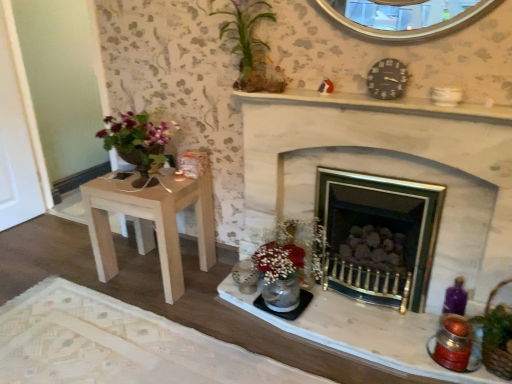
What is the approximate height of white marble mantel at upper center?

The height of white marble mantel at upper center is 1.61 inches.

Locate an element on the screen. Image resolution: width=512 pixels, height=384 pixels. black plastic clock at upper right is located at coordinates point(387,79).

This screenshot has height=384, width=512. In order to click on light brown wood table at left in this screenshot , I will do `click(150, 223)`.

Could you tell me if white stone fireplace at center is facing brown woven basket at lower right?

Yes, white stone fireplace at center is turned towards brown woven basket at lower right.

Locate an element on the screen. basket behind the white stone fireplace at center is located at coordinates (498, 363).

Is white stone fireplace at center touching brown woven basket at lower right?

No, white stone fireplace at center is not next to brown woven basket at lower right.

Based on the photo, from a real-world perspective, is white stone fireplace at center over brown woven basket at lower right?

Yes, from a real-world perspective, white stone fireplace at center is over brown woven basket at lower right

Is there a large distance between shiny metallic candle holder at lower right, the second candle holder from the left, and black plastic clock at upper right?

They are positioned close to each other.

How different are the orientations of shiny metallic candle holder at lower right, the second candle holder from the left, and black plastic clock at upper right in degrees?

There is a 5.84-degree angle between the facing directions of shiny metallic candle holder at lower right, the second candle holder from the left, and black plastic clock at upper right.

Does shiny metallic candle holder at lower right, the second candle holder from the left, have a greater width compared to black plastic clock at upper right?

Yes.

Find the location of a particular element. This screenshot has width=512, height=384. clock above the shiny metallic candle holder at lower right, the second candle holder from the left (from a real-world perspective) is located at coordinates (387, 79).

Are matte silver candle holder at lower center, the first candle holder from the back, and light brown wood table at left making contact?

No, matte silver candle holder at lower center, the first candle holder from the back, is not with light brown wood table at left.

Could you tell me if matte silver candle holder at lower center, the first candle holder from the back, is facing light brown wood table at left?

No, matte silver candle holder at lower center, the first candle holder from the back, is not facing towards light brown wood table at left.

Which of these two, matte silver candle holder at lower center, the first candle holder from the back, or light brown wood table at left, stands taller?

Standing taller between the two is light brown wood table at left.

Does matte silver candle holder at lower center, the first candle holder from the back, have a greater width compared to light brown wood table at left?

No.

Locate an element on the screen. The height and width of the screenshot is (384, 512). fireplace that is above the shiny metallic candle holder at lower right, which ranks as the second candle holder in back-to-front order (from the image's perspective) is located at coordinates (386, 169).

Does point (256, 222) come behind point (466, 323)?

Yes.

Can you confirm if shiny metallic candle holder at lower right, the 1th candle holder in the front-to-back sequence, is shorter than green leafy plant at upper center?

Yes, shiny metallic candle holder at lower right, the 1th candle holder in the front-to-back sequence, is shorter than green leafy plant at upper center.

Which object is further away from the camera taking this photo, shiny metallic candle holder at lower right, the second candle holder from the left, or green leafy plant at upper center?

Positioned behind is green leafy plant at upper center.

From the picture: From the image's perspective, would you say shiny metallic candle holder at lower right, acting as the first candle holder starting from the right, is shown under green leafy plant at upper center?

Yes, from the image's perspective, shiny metallic candle holder at lower right, acting as the first candle holder starting from the right, is below green leafy plant at upper center.

Find the location of a particular element. This screenshot has height=384, width=512. the 1st candle holder positioned below the green leafy plant at upper center (from a real-world perspective) is located at coordinates (453, 343).

From a real-world perspective, is brown woven basket at lower right positioned under white marble mantel at upper center based on gravity?

Yes.

Can you confirm if brown woven basket at lower right is shorter than white marble mantel at upper center?

No.

Is brown woven basket at lower right aimed at white marble mantel at upper center?

No, brown woven basket at lower right does not turn towards white marble mantel at upper center.

Does brown woven basket at lower right lie behind white marble mantel at upper center?

Yes.

Who is taller, light brown wood table at left or white stone fireplace at center?

With more height is white stone fireplace at center.

What's the angular difference between light brown wood table at left and white stone fireplace at center's facing directions?

The angle between the facing direction of light brown wood table at left and the facing direction of white stone fireplace at center is 0.000812 degrees.

Does light brown wood table at left have a lesser width compared to white stone fireplace at center?

No.

Which is in front, point (142, 192) or point (498, 232)?

The point (498, 232) is more forward.

The height and width of the screenshot is (384, 512). In order to click on basket on the right of the white stone fireplace at center in this screenshot , I will do `click(498, 363)`.

Where is `candle holder in front of the black plastic clock at upper right`? The height and width of the screenshot is (384, 512). candle holder in front of the black plastic clock at upper right is located at coordinates (453, 343).

When comparing their distances from matte silver candle holder at lower center, the 2th candle holder when ordered from front to back, does light brown wood table at left or brown woven basket at lower right seem closer?

Based on the image, light brown wood table at left appears to be nearer to matte silver candle holder at lower center, the 2th candle holder when ordered from front to back.

Based on the photo, based on their spatial positions, is light brown wood table at left or matte silver candle holder at lower center, which ranks as the second candle holder in right-to-left order, further from white stone fireplace at center?

Among the two, light brown wood table at left is located further to white stone fireplace at center.

Looking at the image, which one is located closer to matte silver candle holder at lower center, the first candle holder from the back, white marble mantel at upper center or shiny metallic candle holder at lower right, which ranks as the second candle holder in back-to-front order?

The object closer to matte silver candle holder at lower center, the first candle holder from the back, is shiny metallic candle holder at lower right, which ranks as the second candle holder in back-to-front order.

When comparing their distances from matte silver candle holder at lower center, the first candle holder from the back, does brown woven basket at lower right or light brown wood table at left seem further?

Based on the image, brown woven basket at lower right appears to be further to matte silver candle holder at lower center, the first candle holder from the back.

Estimate the real-world distances between objects in this image. Which object is closer to white marble mantel at upper center, matte silver candle holder at lower center, which ranks as the first candle holder in left-to-right order, or shiny metallic candle holder at lower right, which ranks as the second candle holder in back-to-front order?

The object closer to white marble mantel at upper center is matte silver candle holder at lower center, which ranks as the first candle holder in left-to-right order.

Looking at the image, which one is located closer to brown woven basket at lower right, white marble mantel at upper center or black plastic clock at upper right?

white marble mantel at upper center is positioned closer to the anchor brown woven basket at lower right.

Considering their positions, is black plastic clock at upper right positioned closer to light brown wood table at left than brown woven basket at lower right?

black plastic clock at upper right is closer to light brown wood table at left.

Based on their spatial positions, is matte silver candle holder at lower center, the first candle holder from the back, or white stone fireplace at center closer to white marble mantel at upper center?

white stone fireplace at center is closer to white marble mantel at upper center.

Find the location of a particular element. Image resolution: width=512 pixels, height=384 pixels. mantle between green leafy plant at upper center and shiny metallic candle holder at lower right, the second candle holder from the left, in the vertical direction is located at coordinates (381, 105).

The image size is (512, 384). I want to click on mantle that lies between green leafy plant at upper center and matte silver candle holder at lower center, the first candle holder from the back, from top to bottom, so click(x=381, y=105).

This screenshot has height=384, width=512. What are the coordinates of `fireplace between white marble mantel at upper center and matte silver candle holder at lower center, the 2th candle holder when ordered from front to back, vertically` in the screenshot? It's located at (386, 169).

Find the location of a particular element. The image size is (512, 384). clock located between light brown wood table at left and brown woven basket at lower right in the left-right direction is located at coordinates (387, 79).